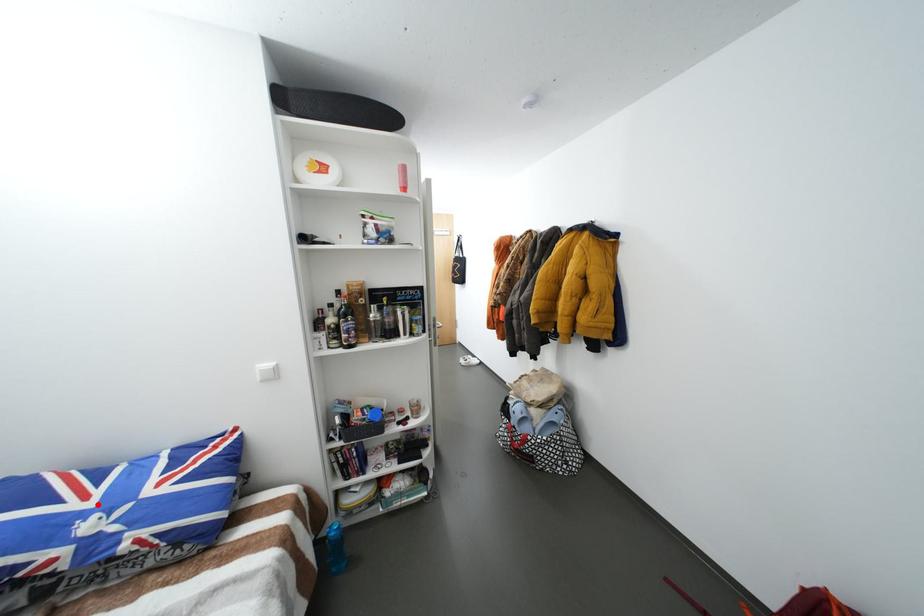
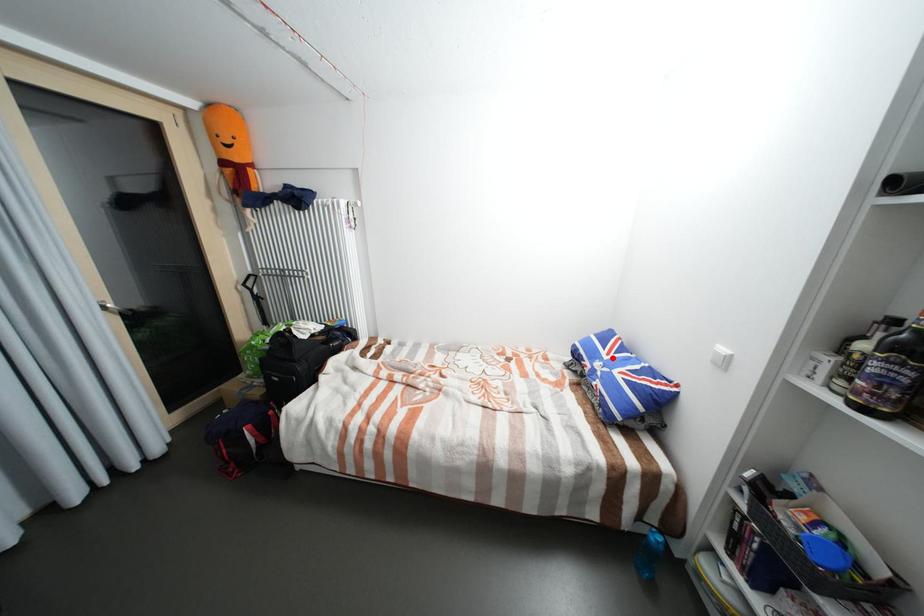
I am providing you with two images of the same scene from different viewpoints. A red point is marked on the first image and another point is marked on the second image. Do the highlighted points in image1 and image2 indicate the same real-world spot?

Yes